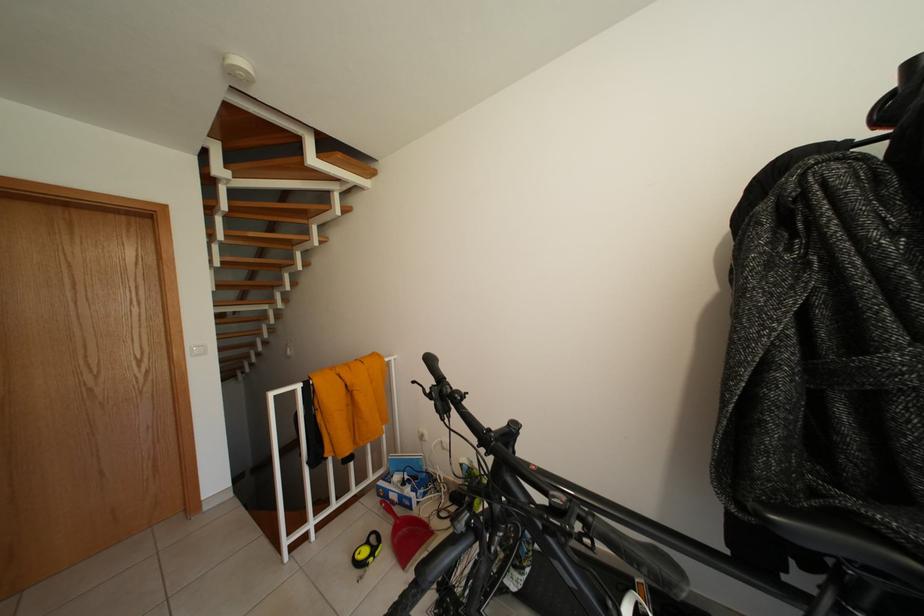
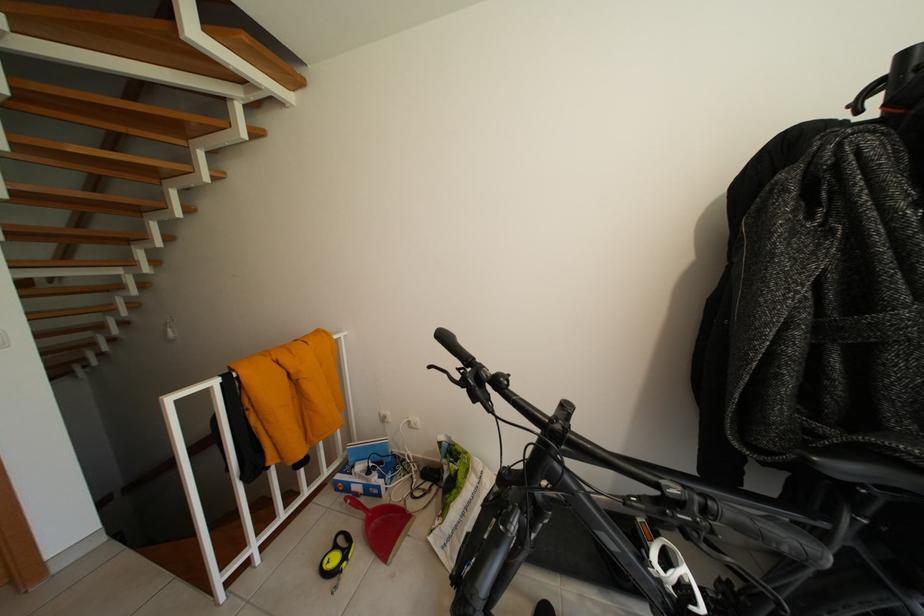
In the second image, find the point that corresponds to (x=313, y=220) in the first image.

(190, 137)